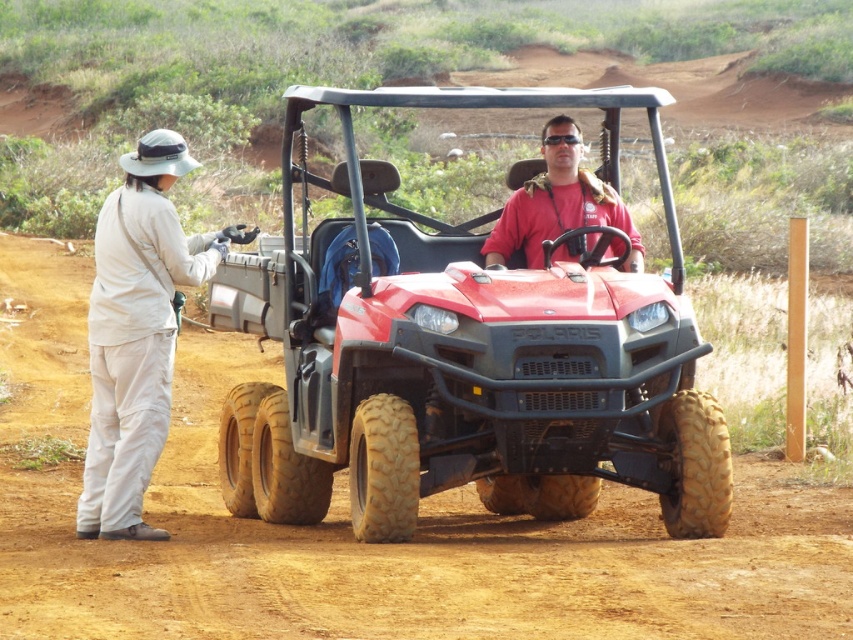
Which is in front, point (268, 426) or point (631, 256)?

Point (631, 256) is more forward.

Does red matte/soft polaris at center appear on the right side of matte red shirt at center?

In fact, red matte/soft polaris at center is to the left of matte red shirt at center.

Is point (341, 96) less distant than point (560, 205)?

Yes, point (341, 96) is in front of point (560, 205).

Identify the location of red matte/soft polaris at center. (462, 353).

Is point (148, 467) positioned behind point (607, 220)?

That is False.

Is light beige fabric hat at left positioned behind matte red shirt at center?

No, light beige fabric hat at left is in front of matte red shirt at center.

At what (x,y) coordinates should I click in order to perform the action: click on light beige fabric hat at left. Please return your answer as a coordinate pair (x, y). Looking at the image, I should click on (136, 333).

Which is below, red matte/soft polaris at center or light beige fabric hat at left?

light beige fabric hat at left is lower down.

Which is more to the left, red matte/soft polaris at center or light beige fabric hat at left?

Positioned to the left is light beige fabric hat at left.

Identify the location of red matte/soft polaris at center. (462, 353).

What are the coordinates of `red matte/soft polaris at center` in the screenshot? It's located at (462, 353).